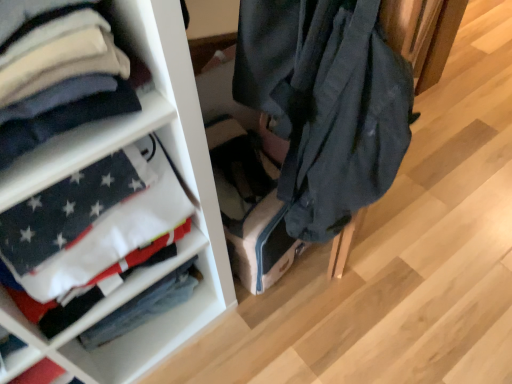
Question: In terms of height, does white fabric at left look taller or shorter compared to white cotton flag at left?

Choices:
 (A) short
 (B) tall

Answer: (B)

Question: Is white fabric at left spatially inside white cotton flag at left, or outside of it?

Choices:
 (A) outside
 (B) inside

Answer: (A)

Question: Based on their relative distances, which object is farther from the white cotton shirt at left?

Choices:
 (A) white cotton flag at left
 (B) white fabric at left

Answer: (A)

Question: Which object is the closest to the white cotton shirt at left?

Choices:
 (A) white fabric at left
 (B) white cotton flag at left

Answer: (A)